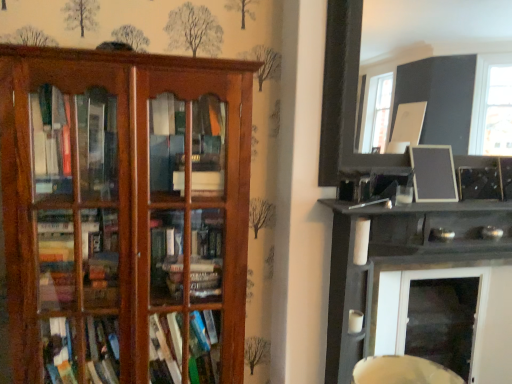
Question: Considering the relative positions of black glossy shelf at upper right, positioned as the 1th shelf in right-to-left order, and black matte picture frame at upper right, which appears as the second picture frame when viewed from the top, in the image provided, is black glossy shelf at upper right, positioned as the 1th shelf in right-to-left order, in front of black matte picture frame at upper right, which appears as the second picture frame when viewed from the top,?

Choices:
 (A) yes
 (B) no

Answer: (A)

Question: From a real-world perspective, is black glossy shelf at upper right, which appears as the second shelf when viewed from the left, located beneath black matte picture frame at upper right, the first picture frame ordered from the bottom?

Choices:
 (A) no
 (B) yes

Answer: (B)

Question: Are black glossy shelf at upper right, which appears as the second shelf when viewed from the left, and black matte picture frame at upper right, the first picture frame ordered from the bottom, making contact?

Choices:
 (A) no
 (B) yes

Answer: (A)

Question: Is black matte picture frame at upper right, the first picture frame ordered from the bottom, at the back of black glossy shelf at upper right, positioned as the 1th shelf in right-to-left order?

Choices:
 (A) yes
 (B) no

Answer: (B)

Question: Considering the relative sizes of black glossy shelf at upper right, which appears as the second shelf when viewed from the left, and black matte picture frame at upper right, which appears as the second picture frame when viewed from the top, in the image provided, is black glossy shelf at upper right, which appears as the second shelf when viewed from the left, shorter than black matte picture frame at upper right, which appears as the second picture frame when viewed from the top,?

Choices:
 (A) yes
 (B) no

Answer: (B)

Question: Is black glossy shelf at upper right, which appears as the second shelf when viewed from the left, in front of or behind black matte picture frame at upper right, which appears as the second picture frame when viewed from the top, in the image?

Choices:
 (A) front
 (B) behind

Answer: (A)

Question: Is black glossy shelf at upper right, positioned as the 1th shelf in right-to-left order, to the left or to the right of black matte picture frame at upper right, the first picture frame ordered from the bottom, in the image?

Choices:
 (A) right
 (B) left

Answer: (A)

Question: Is black glossy shelf at upper right, which appears as the second shelf when viewed from the left, taller or shorter than black matte picture frame at upper right, the first picture frame ordered from the bottom?

Choices:
 (A) tall
 (B) short

Answer: (A)

Question: In terms of width, does black glossy shelf at upper right, positioned as the 1th shelf in right-to-left order, look wider or thinner when compared to black matte picture frame at upper right, the first picture frame ordered from the bottom?

Choices:
 (A) wide
 (B) thin

Answer: (A)

Question: Is point (90, 329) closer or farther from the camera than point (398, 256)?

Choices:
 (A) closer
 (B) farther

Answer: (A)

Question: Is wooden bookshelf at left, which is the 1th shelf in left-to-right order, situated inside black glossy shelf at upper right, which appears as the second shelf when viewed from the left, or outside?

Choices:
 (A) inside
 (B) outside

Answer: (B)

Question: From the image's perspective, is wooden bookshelf at left, the 2th shelf when ordered from right to left, located above or below black glossy shelf at upper right, positioned as the 1th shelf in right-to-left order?

Choices:
 (A) above
 (B) below

Answer: (A)

Question: Is wooden bookshelf at left, which is the 1th shelf in left-to-right order, taller or shorter than black glossy shelf at upper right, which appears as the second shelf when viewed from the left?

Choices:
 (A) short
 (B) tall

Answer: (B)

Question: Is wooden bookshelf at left, the 2th shelf when ordered from right to left, bigger or smaller than matte black picture frame at upper right, the 1th picture frame viewed from the top?

Choices:
 (A) big
 (B) small

Answer: (A)

Question: Would you say wooden bookshelf at left, the 2th shelf when ordered from right to left, is to the left or to the right of matte black picture frame at upper right, acting as the 2th picture frame starting from the bottom, in the picture?

Choices:
 (A) left
 (B) right

Answer: (A)